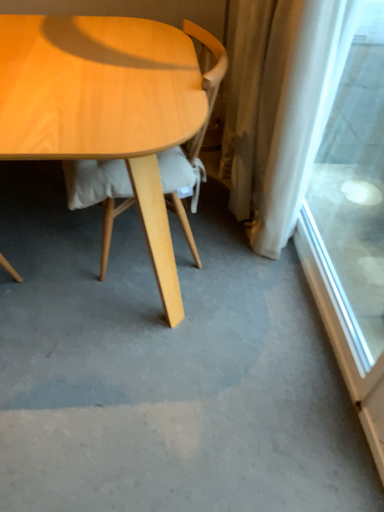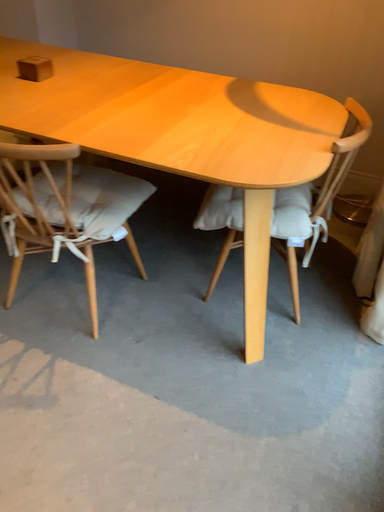
Question: Which way did the camera rotate in the video?

Choices:
 (A) rotated left
 (B) rotated right

Answer: (A)